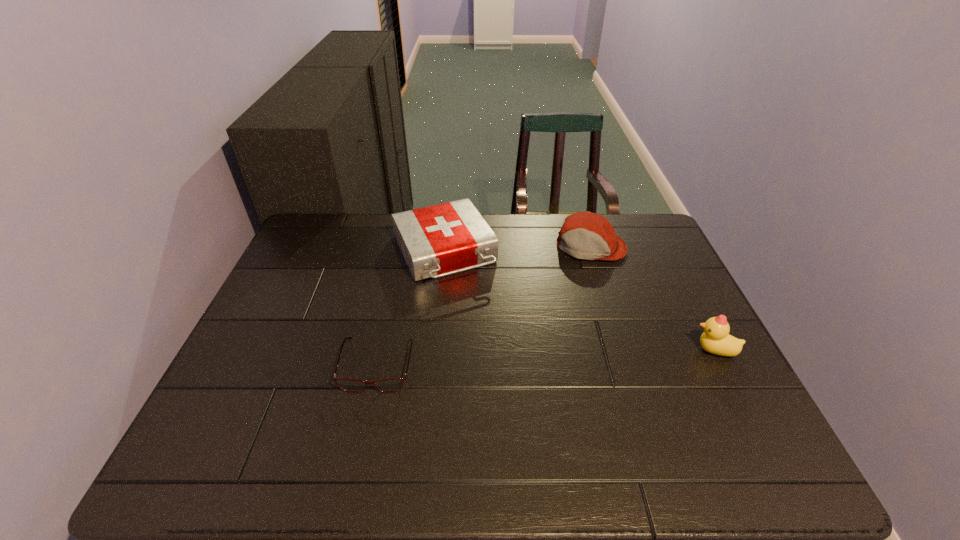
What are the coordinates of `free space located on the front side of the first-aid kit` in the screenshot? It's located at (470, 307).

Locate an element on the screen. free region located 0.160m on the front side of the first-aid kit is located at coordinates [483, 330].

Locate an element on the screen. This screenshot has width=960, height=540. vacant space situated 0.250m on the front side of the first-aid kit is located at coordinates (497, 355).

This screenshot has width=960, height=540. Find the location of `cap at the far edge`. cap at the far edge is located at coordinates (584, 235).

Identify the location of the first-aid kit that is at the far edge. (439, 240).

This screenshot has height=540, width=960. I want to click on duckling that is at the right edge, so click(x=715, y=339).

At what (x,y) coordinates should I click in order to perform the action: click on cap situated at the right edge. Please return your answer as a coordinate pair (x, y). Looking at the image, I should click on (584, 235).

What are the coordinates of `object that is at the far right corner` in the screenshot? It's located at (584, 235).

Locate an element on the screen. This screenshot has width=960, height=540. free spot at the far edge of the desktop is located at coordinates (550, 221).

In the image, there is a desktop. Identify the location of vacant space at the near edge. (284, 423).